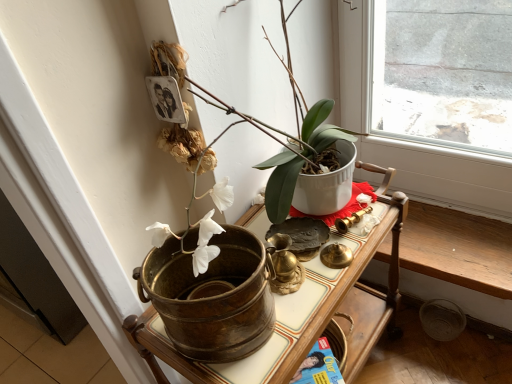
Question: Is white glossy pot at upper center turned away from brass textured bucket at center?

Choices:
 (A) no
 (B) yes

Answer: (A)

Question: Is white glossy pot at upper center at the right side of brass textured bucket at center?

Choices:
 (A) yes
 (B) no

Answer: (B)

Question: Is white glossy pot at upper center outside of brass textured bucket at center?

Choices:
 (A) yes
 (B) no

Answer: (A)

Question: Is white glossy pot at upper center facing towards brass textured bucket at center?

Choices:
 (A) no
 (B) yes

Answer: (A)

Question: From the image's perspective, is white glossy pot at upper center under brass textured bucket at center?

Choices:
 (A) no
 (B) yes

Answer: (A)

Question: Is white glossy pot at upper center directly adjacent to brass textured bucket at center?

Choices:
 (A) no
 (B) yes

Answer: (A)

Question: Does brass textured bucket at center have a smaller size compared to white glossy pot at upper center?

Choices:
 (A) no
 (B) yes

Answer: (A)

Question: Does brass textured bucket at center have a lesser width compared to white glossy pot at upper center?

Choices:
 (A) no
 (B) yes

Answer: (A)

Question: Is brass textured bucket at center bigger than white glossy pot at upper center?

Choices:
 (A) yes
 (B) no

Answer: (A)

Question: Does brass textured bucket at center lie behind white glossy pot at upper center?

Choices:
 (A) yes
 (B) no

Answer: (A)

Question: Does brass textured bucket at center turn towards white glossy pot at upper center?

Choices:
 (A) yes
 (B) no

Answer: (B)

Question: Is white glossy pot at upper center at the back of brass textured bucket at center?

Choices:
 (A) no
 (B) yes

Answer: (A)

Question: Considering their positions, is white glossy pot at upper center located in front of or behind brass textured bucket at center?

Choices:
 (A) behind
 (B) front

Answer: (B)